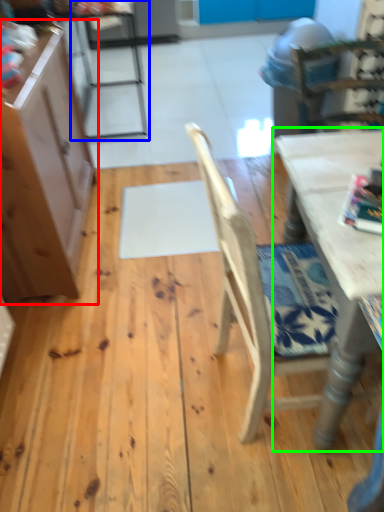
Question: Which is nearer to the cabinetry (highlighted by a red box)? chair (highlighted by a blue box) or table (highlighted by a green box).

Choices:
 (A) chair
 (B) table

Answer: (B)